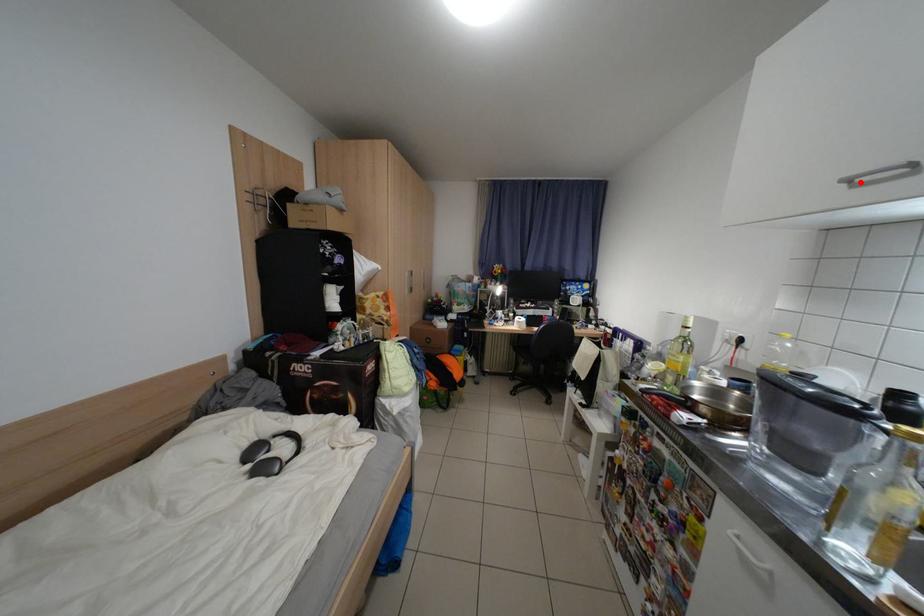
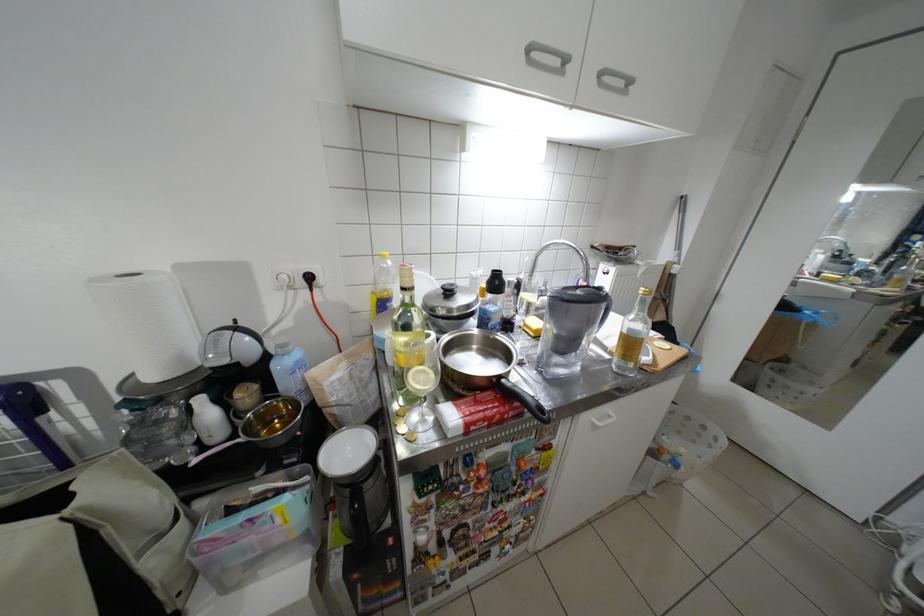
Where in the second image is the point corresponding to the highlighted location from the first image?

(541, 51)